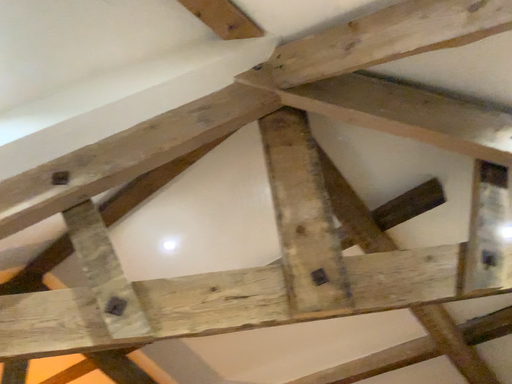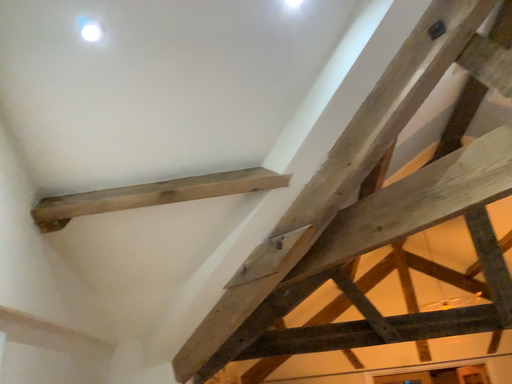
Question: Which way did the camera rotate in the video?

Choices:
 (A) rotated right
 (B) rotated left

Answer: (B)